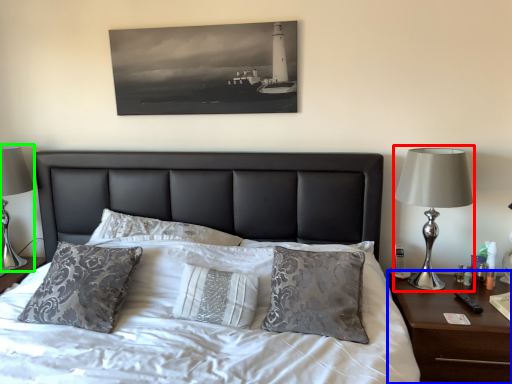
Question: Considering the real-world distances, which object is farthest from bedside lamp (highlighted by a red box)? nightstand (highlighted by a blue box) or table lamp (highlighted by a green box)?

Choices:
 (A) nightstand
 (B) table lamp

Answer: (B)